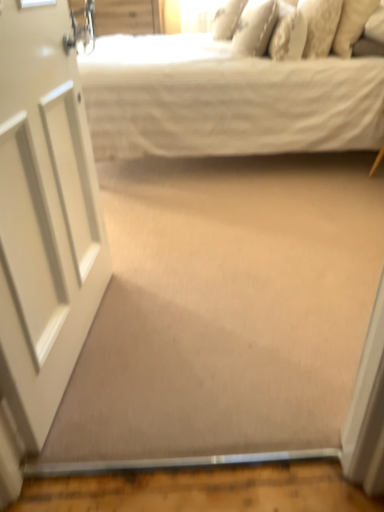
Question: Is white textured pillow at upper center, positioned as the 2th pillow in left-to-right order, far away from white cotton bed at upper center?

Choices:
 (A) no
 (B) yes

Answer: (A)

Question: From the image's perspective, is white textured pillow at upper center, which is the 4th pillow from right to left, above white cotton bed at upper center?

Choices:
 (A) no
 (B) yes

Answer: (B)

Question: Would you say white textured pillow at upper center, which is the 4th pillow from right to left, is outside white cotton bed at upper center?

Choices:
 (A) yes
 (B) no

Answer: (B)

Question: Can you confirm if white textured pillow at upper center, which is the 4th pillow from right to left, is smaller than white cotton bed at upper center?

Choices:
 (A) yes
 (B) no

Answer: (A)

Question: Considering the relative sizes of white textured pillow at upper center, positioned as the 2th pillow in left-to-right order, and white cotton bed at upper center in the image provided, is white textured pillow at upper center, positioned as the 2th pillow in left-to-right order, taller than white cotton bed at upper center?

Choices:
 (A) yes
 (B) no

Answer: (B)

Question: Is the position of white textured pillow at upper center, positioned as the 2th pillow in left-to-right order, more distant than that of white cotton bed at upper center?

Choices:
 (A) yes
 (B) no

Answer: (A)

Question: Would you say white glossy door at left contains white textured pillow at upper center, the 3th pillow positioned from the left?

Choices:
 (A) yes
 (B) no

Answer: (B)

Question: Is white glossy door at left to the right of white textured pillow at upper center, the 3th pillow positioned from the left, from the viewer's perspective?

Choices:
 (A) no
 (B) yes

Answer: (A)

Question: Considering the relative sizes of white glossy door at left and white textured pillow at upper center, the 3th pillow positioned from the left, in the image provided, is white glossy door at left bigger than white textured pillow at upper center, the 3th pillow positioned from the left,?

Choices:
 (A) no
 (B) yes

Answer: (B)

Question: From a real-world perspective, is white glossy door at left physically above white textured pillow at upper center, the 3th pillow positioned from the left?

Choices:
 (A) no
 (B) yes

Answer: (A)

Question: From the image's perspective, is white glossy door at left under white textured pillow at upper center, which is counted as the 3th pillow, starting from the right?

Choices:
 (A) no
 (B) yes

Answer: (B)

Question: Can you confirm if white glossy door at left is taller than white textured pillow at upper center, the 3th pillow positioned from the left?

Choices:
 (A) yes
 (B) no

Answer: (A)

Question: Is white cotton bed at upper center located outside white textured pillow at upper center, the 3th pillow positioned from the left?

Choices:
 (A) yes
 (B) no

Answer: (A)